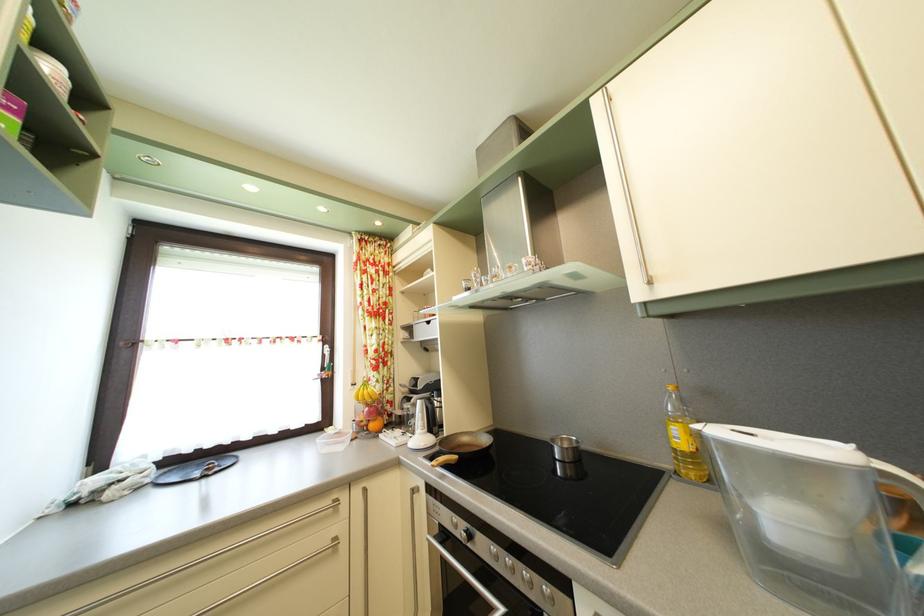
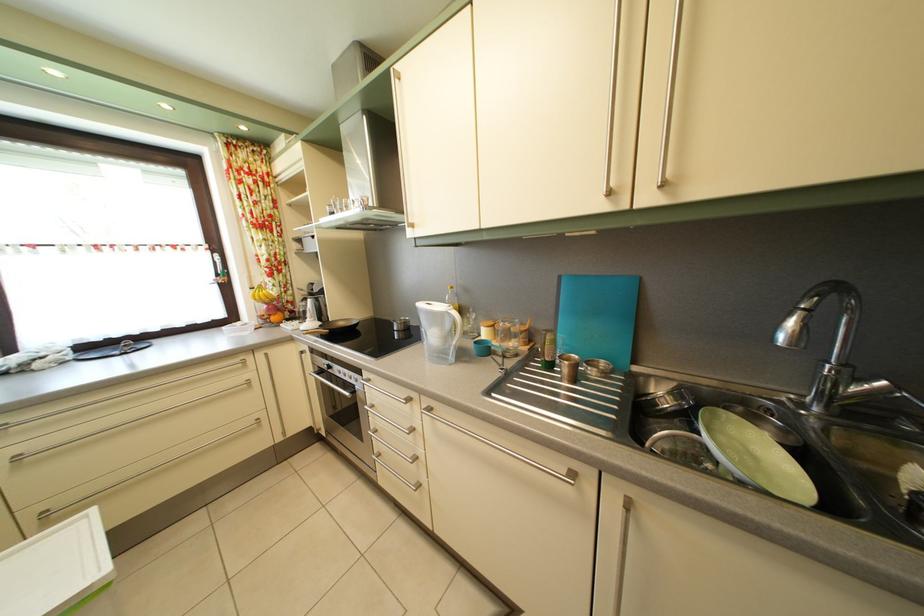
Question: I am providing you with two images of the same scene from different viewpoints. After the viewpoint changes to image2, which objects are now occluded?

Choices:
 (A) metal cabinet handle
 (B) window handle
 (C) copper-colored cup
 (D) none of these

Answer: (D)